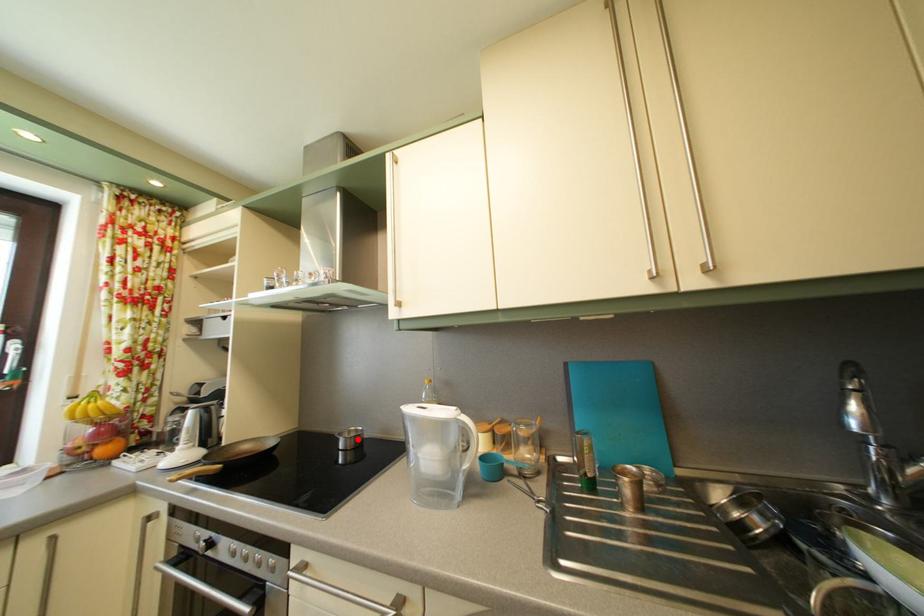
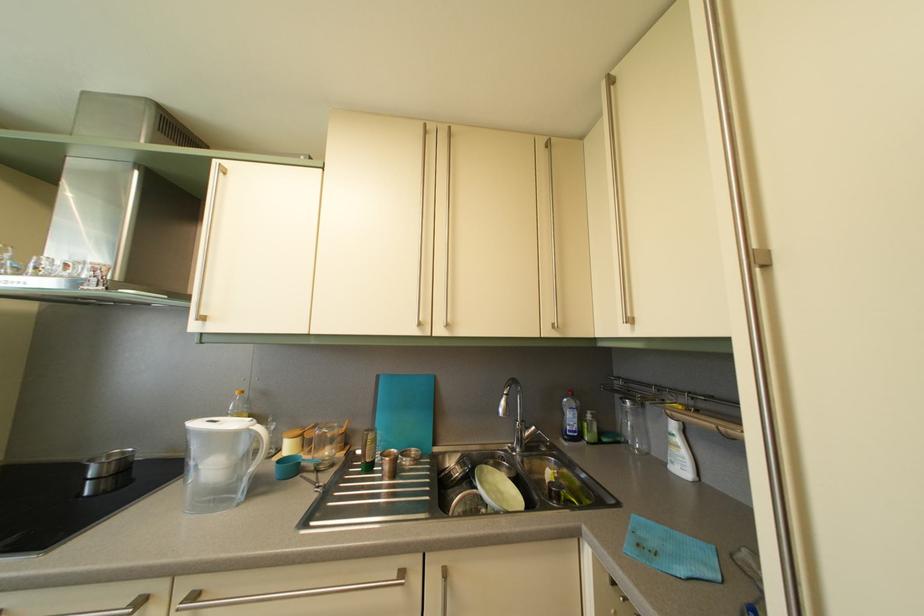
In the second image, find the point that corresponds to the highlighted location in the first image.

(118, 463)